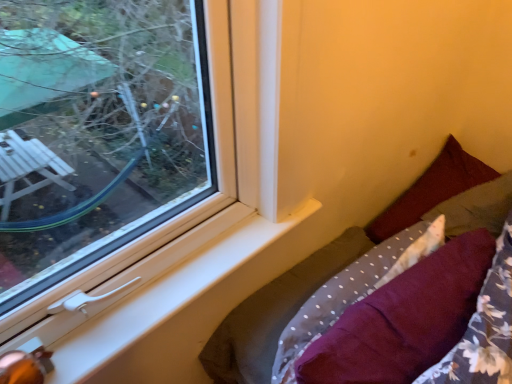
Question: In the image, is maroon fabric pillow at right, which appears as the 3th pillow when viewed from the left, positioned in front of or behind maroon fabric pillow at lower right, the third pillow viewed from the right?

Choices:
 (A) front
 (B) behind

Answer: (B)

Question: From their relative heights in the image, would you say maroon fabric pillow at right, arranged as the first pillow when viewed from the right, is taller or shorter than maroon fabric pillow at lower right, the third pillow viewed from the right?

Choices:
 (A) short
 (B) tall

Answer: (A)

Question: Considering the real-world distances, which object is farthest from the maroon fabric pillow at lower right, placed as the first pillow when sorted from left to right?

Choices:
 (A) maroon fabric pillow at right, the 2th pillow when ordered from left to right
 (B) velvet burgundy pillow at lower right
 (C) white plastic window sill at lower left
 (D) maroon fabric pillow at right, arranged as the first pillow when viewed from the right

Answer: (A)

Question: Which is farther from the white plastic window sill at lower left?

Choices:
 (A) maroon fabric pillow at right, the 2th pillow when ordered from left to right
 (B) maroon fabric pillow at lower right, placed as the first pillow when sorted from left to right
 (C) maroon fabric pillow at right, which appears as the 3th pillow when viewed from the left
 (D) velvet burgundy pillow at lower right

Answer: (C)